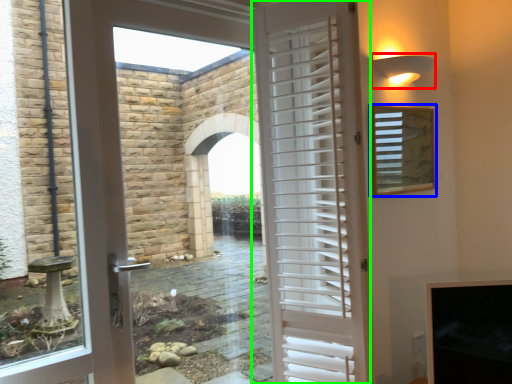
Question: Based on their relative distances, which object is nearer to light fixture (highlighted by a red box)? Choose from window screen (highlighted by a blue box) and door (highlighted by a green box).

Choices:
 (A) window screen
 (B) door

Answer: (A)